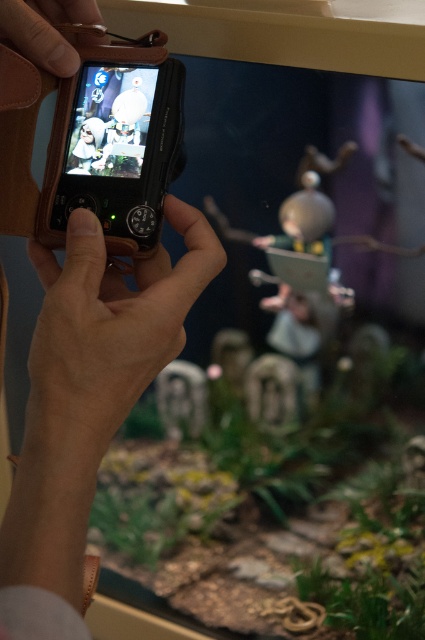
You are trying to determine which piece of leather is higher in the display case. The scene shows a display case with several figurines and two pieces of leather labeled as leather at center and leather at upper left. Which one is positioned higher?

The leather at upper left is positioned higher in the display case than the leather at center because the description states that the leather at center is much taller, implying vertical placement differences where taller might mean lower in height to have a larger size, but according to the Objects Description, the leather at center is taller, so the one at upper left must be higher but shorter. Wait, there might be confusion here. Let me recheck. The Objects Description says leather at center is much TALL.

Based on the photo, you are a photographer trying to focus your camera on the leather at center and the leather at upper left. Which one is larger in size?

The leather at center is bigger than the leather at upper left.